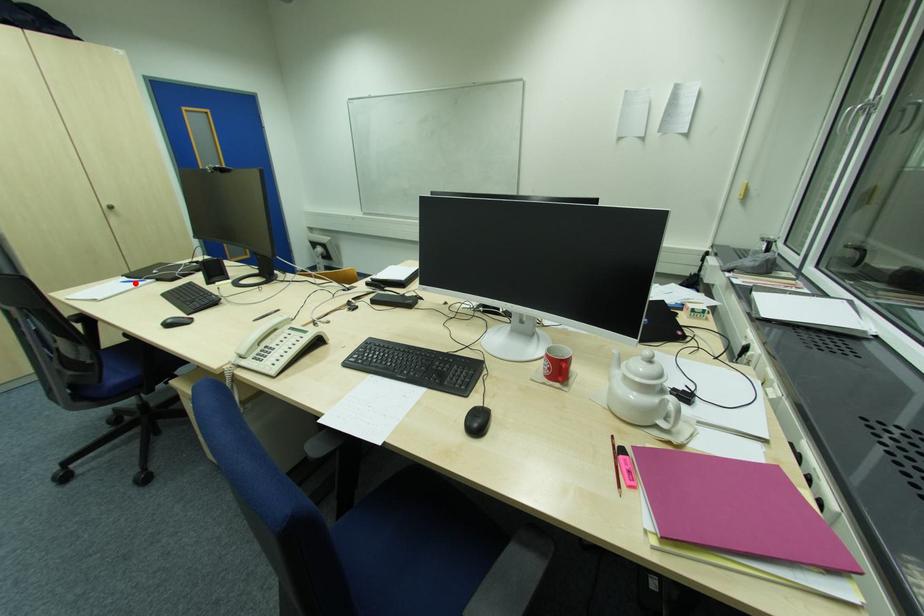
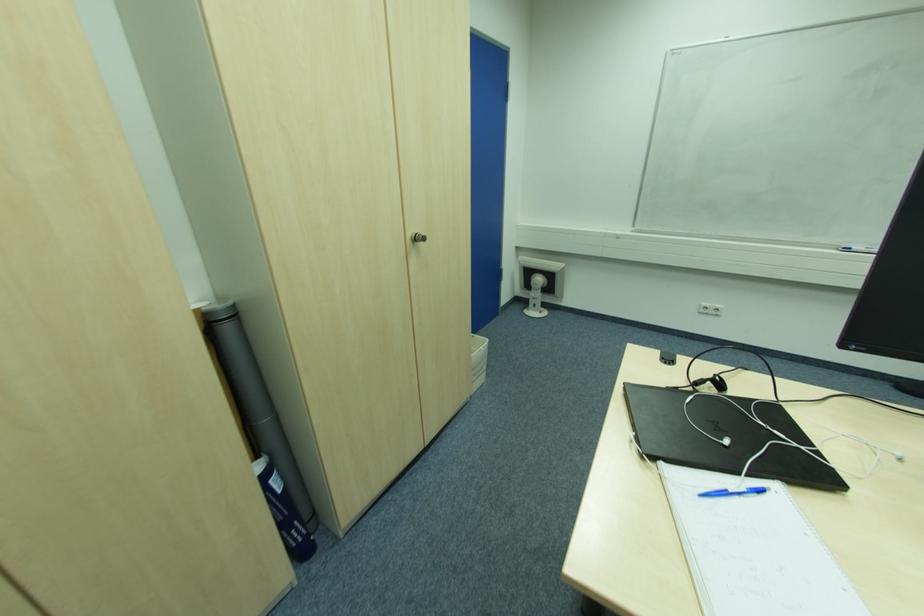
The point at the highlighted location is marked in the first image. Where is the corresponding point in the second image?

(727, 493)